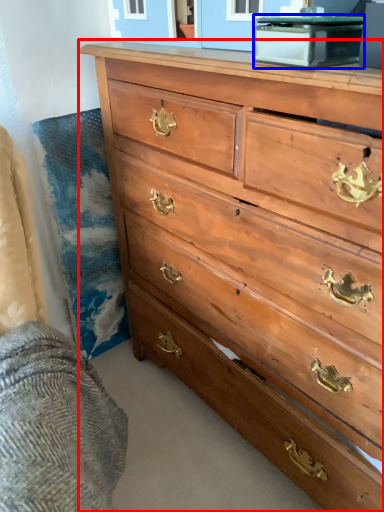
Question: Which object is further to the camera taking this photo, chest of drawers (highlighted by a red box) or cabinetry (highlighted by a blue box)?

Choices:
 (A) chest of drawers
 (B) cabinetry

Answer: (B)